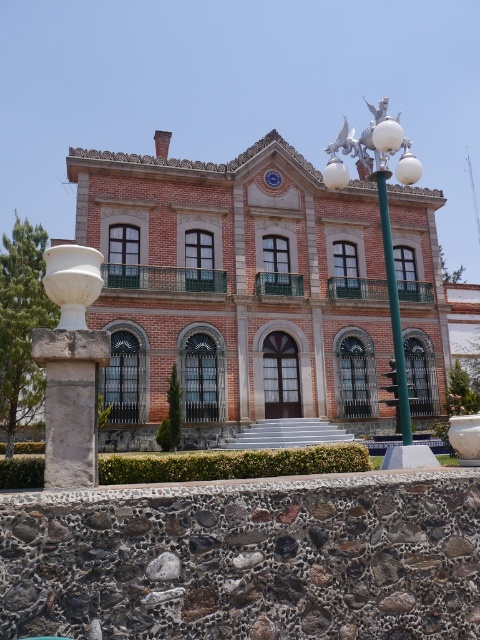
Question: Can you confirm if white stone vase at left is thinner than green metallic pole at center?

Choices:
 (A) yes
 (B) no

Answer: (B)

Question: Based on their relative distances, which object is farther from the metallic silver lamp post at center?

Choices:
 (A) white stone vase at left
 (B) green metallic pole at center

Answer: (A)

Question: Is metallic silver lamp post at center bigger than green metallic pole at center?

Choices:
 (A) no
 (B) yes

Answer: (B)

Question: Is white stone vase at left positioned before green metallic pole at center?

Choices:
 (A) no
 (B) yes

Answer: (B)

Question: Which of these objects is positioned closest to the white stone vase at left?

Choices:
 (A) green metallic pole at center
 (B) metallic silver lamp post at center

Answer: (A)

Question: Which of the following is the closest to the observer?

Choices:
 (A) metallic silver lamp post at center
 (B) white stone vase at left

Answer: (B)